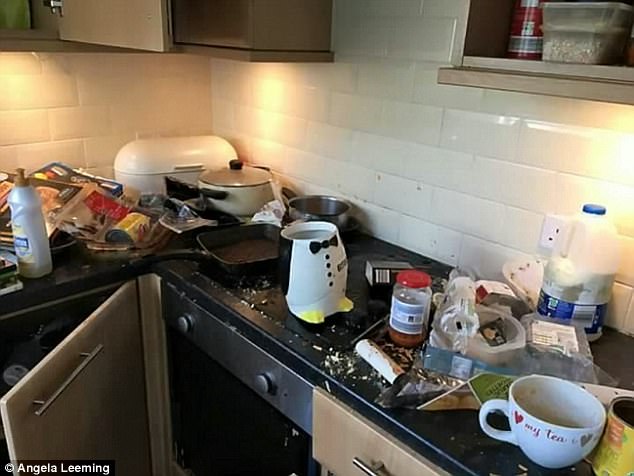
This screenshot has height=476, width=634. I want to click on skillet, so click(x=235, y=246).